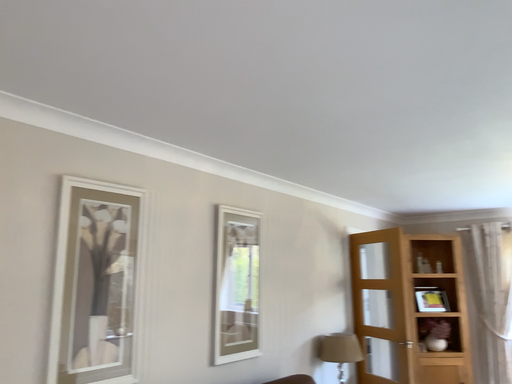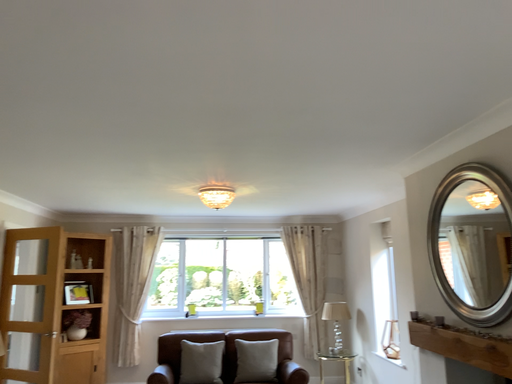
Question: How did the camera likely rotate when shooting the video?

Choices:
 (A) rotated left
 (B) rotated right

Answer: (B)